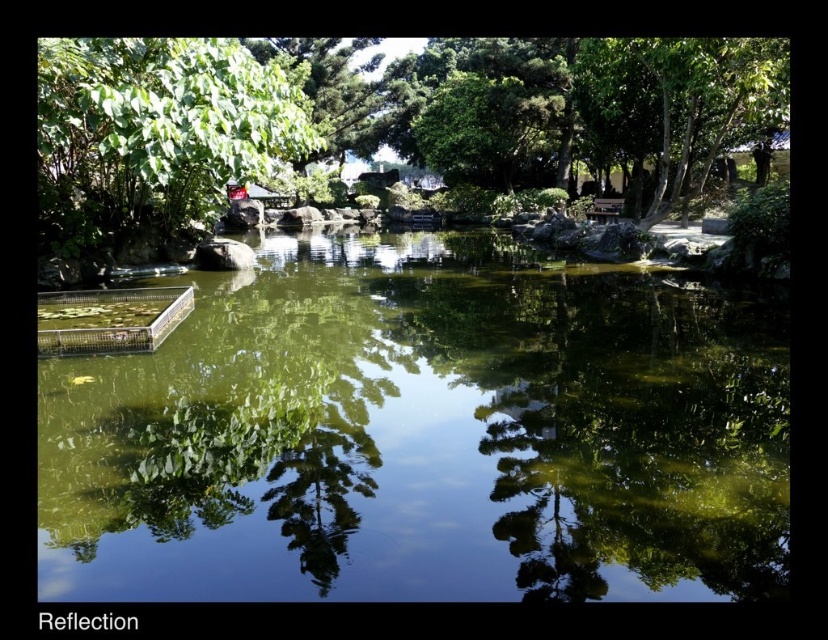
You are standing at the edge of the pond and see a point marked at coordinates (153, 132). What object is located at that point?

The point at coordinates (153, 132) indicates a green leafy tree at upper left.

Based on the photo, you are standing at the edge of the pond and see two points in the water. The first point is at coordinate point [128,109] and the second is at point [740,120]. Which point is closer to you?

Point [128,109] is closer to the viewer than point [740,120].